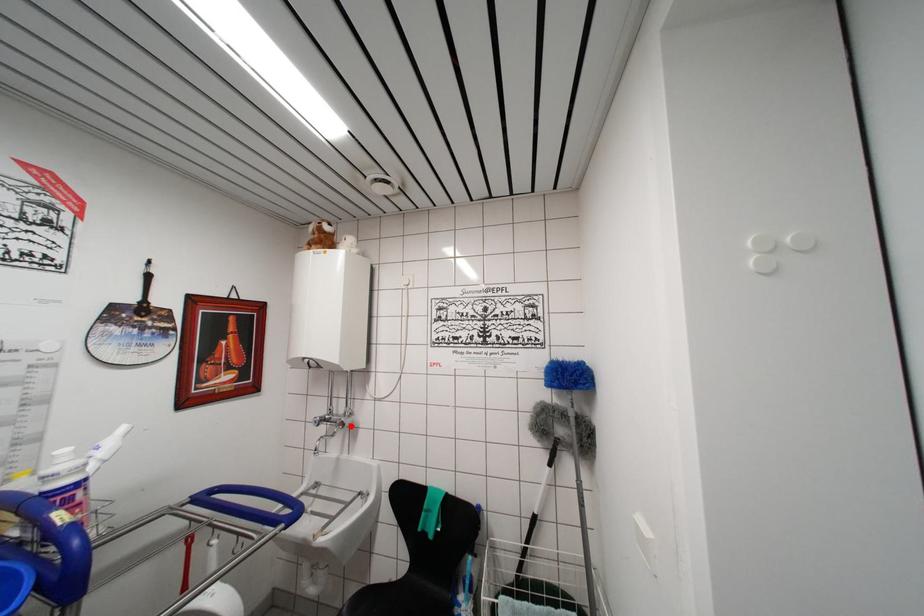
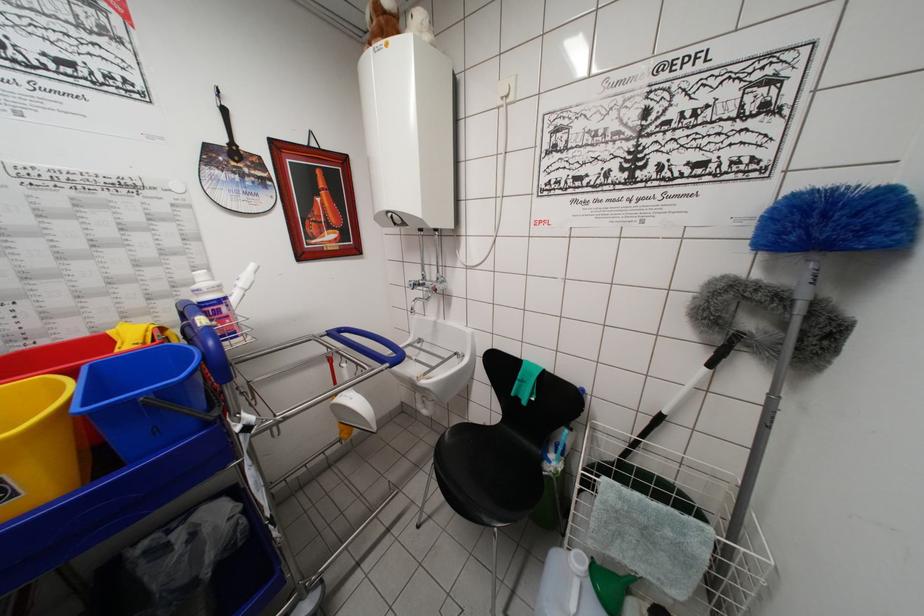
Find the pixel in the second image that matches the highlighted location in the first image.

(443, 292)